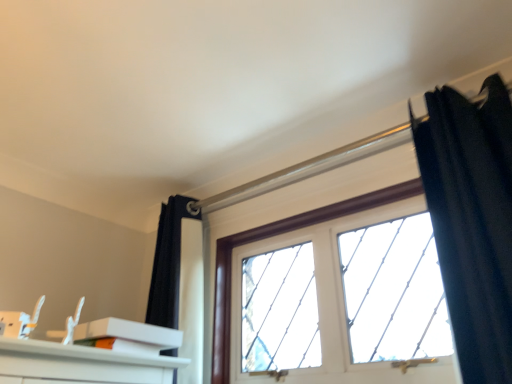
This screenshot has height=384, width=512. In order to click on black velvet curtain at upper right in this screenshot , I will do `click(472, 220)`.

What do you see at coordinates (272, 236) in the screenshot? The height and width of the screenshot is (384, 512). I see `clear glass window at center` at bounding box center [272, 236].

This screenshot has width=512, height=384. In order to click on black velvet curtain at upper right in this screenshot , I will do `click(472, 220)`.

From the image's perspective, between clear glass window at center and white matte box at lower left, which one is located above?

clear glass window at center is shown above in the image.

Is clear glass window at center facing away from white matte box at lower left?

clear glass window at center is not turned away from white matte box at lower left.

Are clear glass window at center and white matte box at lower left beside each other?

No, clear glass window at center is not making contact with white matte box at lower left.

Which object is positioned more to the right, clear glass window at center or white matte box at lower left?

clear glass window at center is more to the right.

Is point (168, 348) positioned in front of point (216, 367)?

Yes, point (168, 348) is in front of point (216, 367).

From the image's perspective, which one is positioned lower, white matte box at lower left or clear glass window at center?

white matte box at lower left.

Is white matte box at lower left completely or partially outside of clear glass window at center?

Yes, white matte box at lower left is outside of clear glass window at center.

Is white matte box at lower left thinner than clear glass window at center?

Yes.

Is white matte box at lower left not near black velvet curtain at upper right?

No, white matte box at lower left is not far from black velvet curtain at upper right.

Could black velvet curtain at upper right be considered to be inside white matte box at lower left?

Actually, black velvet curtain at upper right is outside white matte box at lower left.

What are the coordinates of `curtain that appears above the white matte box at lower left (from the image's perspective)` in the screenshot? It's located at (472, 220).

Is point (437, 217) less distant than point (142, 328)?

That is True.

Where is `shelf located behind the black velvet curtain at upper right`? This screenshot has width=512, height=384. shelf located behind the black velvet curtain at upper right is located at coordinates (127, 336).

From the picture: Is black velvet curtain at upper right turned away from white matte box at lower left?

black velvet curtain at upper right does not have its back to white matte box at lower left.

Is black velvet curtain at upper right inside or outside of clear glass window at center?

black velvet curtain at upper right is located beyond the bounds of clear glass window at center.

How many degrees apart are the facing directions of black velvet curtain at upper right and clear glass window at center?

0.365 degrees separate the facing orientations of black velvet curtain at upper right and clear glass window at center.

From a real-world perspective, which object rests below the other?

clear glass window at center, from a real-world perspective.

Considering the positions of objects black velvet curtain at upper right and clear glass window at center in the image provided, who is more to the right, black velvet curtain at upper right or clear glass window at center?

black velvet curtain at upper right is more to the right.

Does clear glass window at center have a lesser height compared to black velvet curtain at upper right?

Correct, clear glass window at center is not as tall as black velvet curtain at upper right.

Between clear glass window at center and black velvet curtain at upper right, which one has smaller size?

black velvet curtain at upper right is smaller.

Is clear glass window at center in front of or behind black velvet curtain at upper right in the image?

In the image, clear glass window at center appears behind black velvet curtain at upper right.

This screenshot has width=512, height=384. I want to click on shelf behind the clear glass window at center, so click(x=127, y=336).

Identify the location of window to the right of white matte box at lower left. The height and width of the screenshot is (384, 512). (272, 236).

When comparing their distances from clear glass window at center, does white matte box at lower left or black velvet curtain at upper right seem closer?

The object closer to clear glass window at center is black velvet curtain at upper right.

Looking at the image, which one is located further to black velvet curtain at upper right, clear glass window at center or white matte box at lower left?

The object further to black velvet curtain at upper right is white matte box at lower left.

When comparing their distances from black velvet curtain at upper right, does white matte box at lower left or clear glass window at center seem closer?

clear glass window at center lies closer to black velvet curtain at upper right than the other object.

Looking at this image, from the image, which object appears to be farther from white matte box at lower left, black velvet curtain at upper right or clear glass window at center?

Based on the image, black velvet curtain at upper right appears to be further to white matte box at lower left.

Based on their spatial positions, is black velvet curtain at upper right or white matte box at lower left further from clear glass window at center?

white matte box at lower left is positioned further to the anchor clear glass window at center.

Estimate the real-world distances between objects in this image. Which object is closer to white matte box at lower left, clear glass window at center or black velvet curtain at upper right?

clear glass window at center.

Find the location of `window between white matte box at lower left and black velvet curtain at upper right`. window between white matte box at lower left and black velvet curtain at upper right is located at coordinates (272, 236).